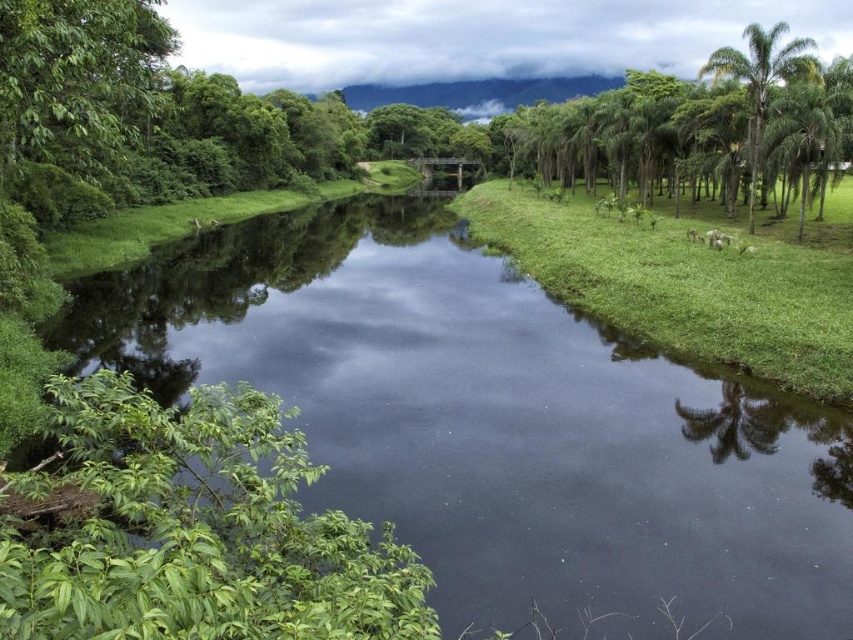
You are standing on the bridge looking towards the right side of the river. Which object, the green grassy at right or the green leafy palm tree at upper right, is closer to you?

The green grassy at right is closer to you because it is positioned under the green leafy palm tree at upper right, meaning the palm tree is further away.